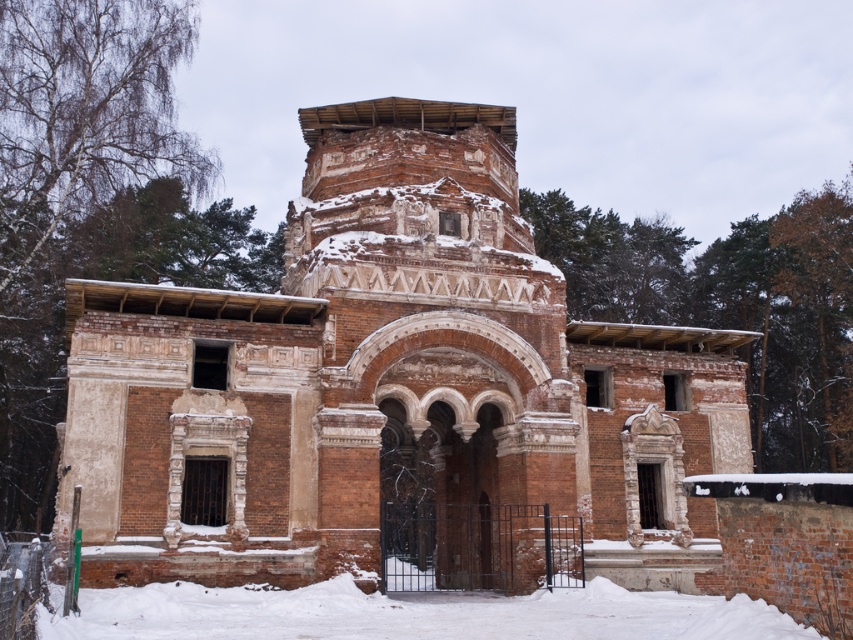
Based on the scene description, what does the point at coordinates (392, 385) represent?

The point at coordinates (392, 385) represents the reddish brown brick church at center.